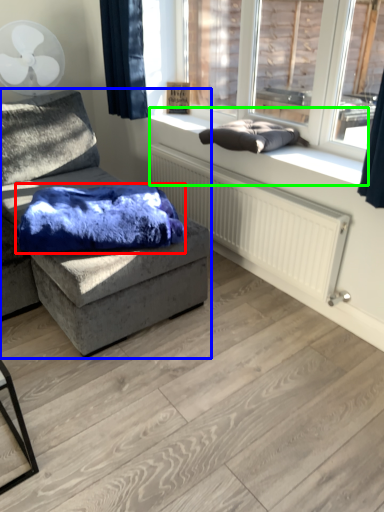
Question: Which object is the closest to the material (highlighted by a red box)? Choose among these: studio couch (highlighted by a blue box) or window sill (highlighted by a green box).

Choices:
 (A) studio couch
 (B) window sill

Answer: (A)